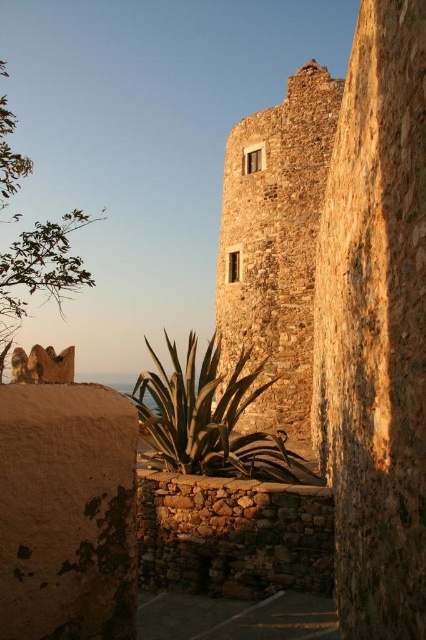
Can you confirm if rustic stone tower at center is taller than green leafy plant at center?

Correct, rustic stone tower at center is much taller as green leafy plant at center.

The image size is (426, 640). What do you see at coordinates (276, 243) in the screenshot?
I see `rustic stone tower at center` at bounding box center [276, 243].

Which is in front, point (305, 88) or point (201, 454)?

Point (201, 454) is more forward.

What are the coordinates of `rustic stone tower at center` in the screenshot? It's located at (276, 243).